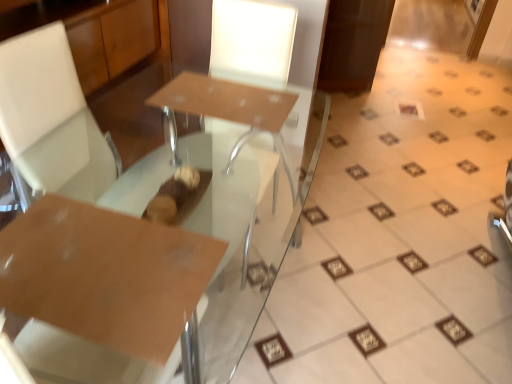
Question: Choose the correct answer: Is white glossy frame at upper right inside glossy brown table at center or outside it?

Choices:
 (A) outside
 (B) inside

Answer: (A)

Question: Is white glossy frame at upper right wider or thinner than glossy brown table at center?

Choices:
 (A) thin
 (B) wide

Answer: (A)

Question: Estimate the real-world distances between objects in this image. Which object is closer to the glossy brown table at center?

Choices:
 (A) matte brown table at center
 (B) white glossy frame at upper right

Answer: (A)

Question: Based on their relative distances, which object is nearer to the white glossy frame at upper right?

Choices:
 (A) matte brown table at center
 (B) glossy brown table at center

Answer: (A)